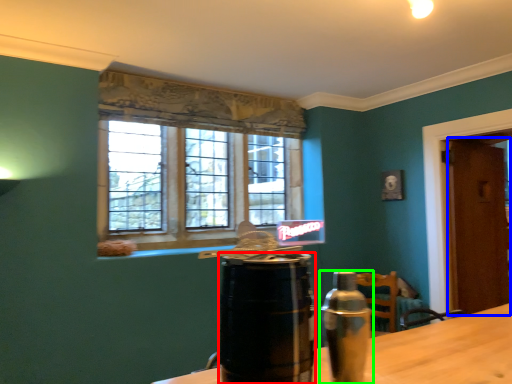
Question: Estimate the real-world distances between objects in this image. Which object is farther from beverage (highlighted by a red box), door (highlighted by a blue box) or bottle (highlighted by a green box)?

Choices:
 (A) door
 (B) bottle

Answer: (A)